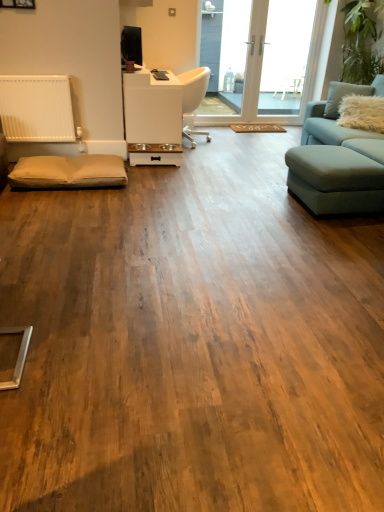
Identify the location of free space in front of beige fabric footrest at lower left. The height and width of the screenshot is (512, 384). (70, 206).